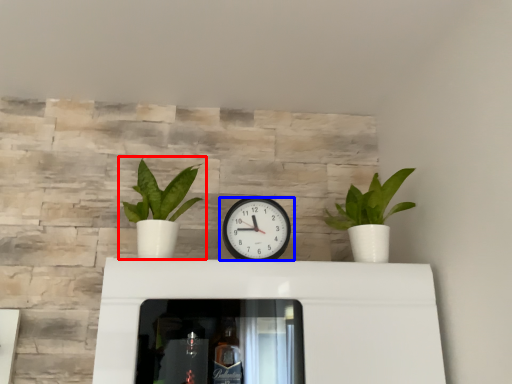
Question: Among these objects, which one is nearest to the camera, houseplant (highlighted by a red box) or wall clock (highlighted by a blue box)?

Choices:
 (A) houseplant
 (B) wall clock

Answer: (A)